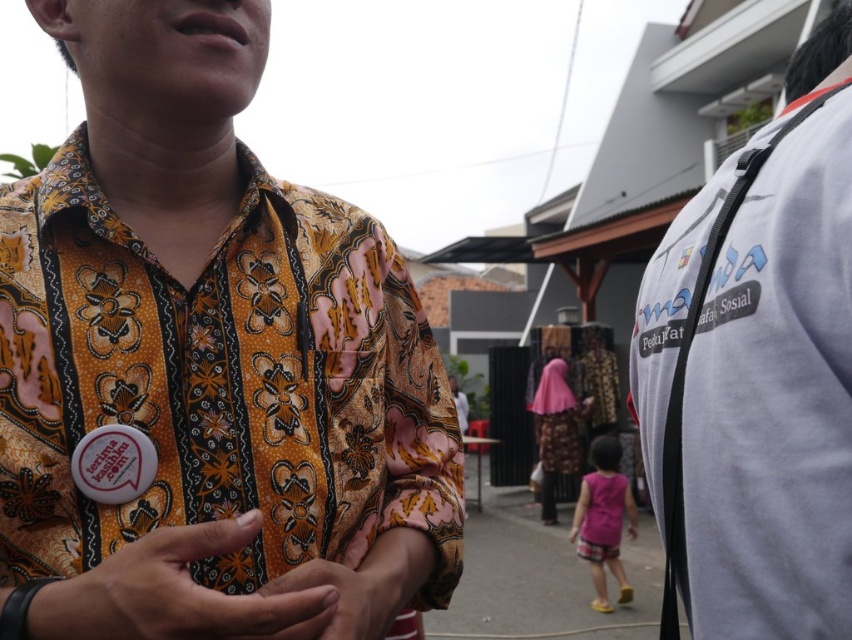
Which is above, pink fabric dress at lower center or matte floral shirt at center?

matte floral shirt at center

Does point (603, 582) lie in front of point (324, 572)?

No, it is not.

The height and width of the screenshot is (640, 852). Identify the location of pink fabric dress at lower center. (603, 518).

Where is `pink fabric dress at lower center`? Image resolution: width=852 pixels, height=640 pixels. pink fabric dress at lower center is located at coordinates (603, 518).

Can you confirm if white fabric shirt at right is smaller than matte floral shirt at center?

Incorrect, white fabric shirt at right is not smaller in size than matte floral shirt at center.

Measure the distance between white fabric shirt at right and matte floral shirt at center.

white fabric shirt at right is 22.92 inches from matte floral shirt at center.

Is point (746, 417) positioned in front of point (317, 616)?

No, (746, 417) is behind (317, 616).

Locate an element on the screen. white fabric shirt at right is located at coordinates (757, 374).

Is point (847, 518) less distant than point (197, 589)?

No, it is not.

Can you confirm if white fabric shirt at right is taller than matte fabric hand at center?

Yes, white fabric shirt at right is taller than matte fabric hand at center.

Between point (691, 356) and point (121, 628), which one is positioned behind?

Point (691, 356)

You are a GUI agent. You are given a task and a screenshot of the screen. Output one action in this format:
    pyautogui.click(x=<x>, y=<y>)
    Task: Click on the white fabric shirt at right
    This screenshot has height=640, width=852.
    Given the screenshot: What is the action you would take?
    pyautogui.click(x=757, y=374)